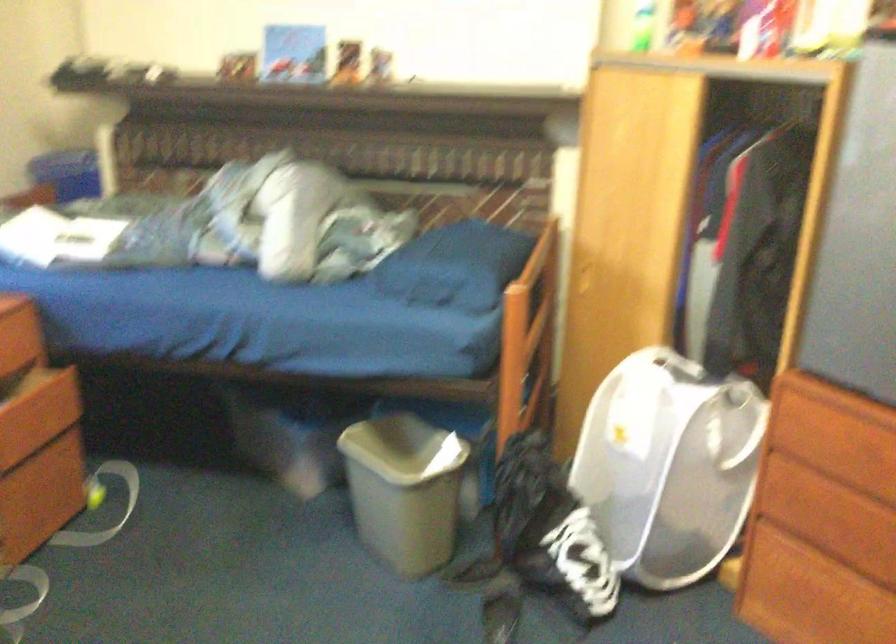
This screenshot has height=644, width=896. I want to click on wardrobe door, so click(x=613, y=182).